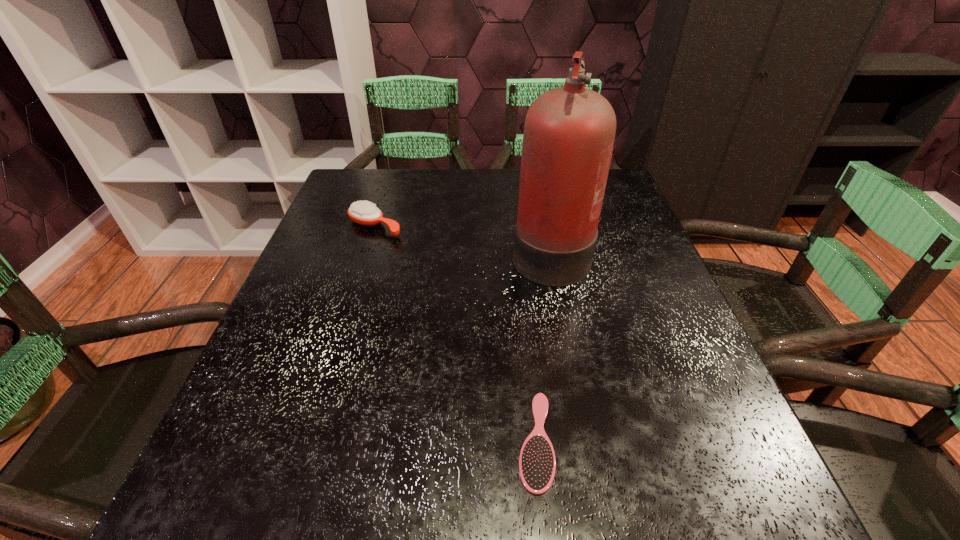
Locate which object is the closest to the nearer hairbrush. Please provide its 2D coordinates. Your answer should be formatted as a tuple, i.e. [(x, y)], where the tuple contains the x and y coordinates of a point satisfying the conditions above.

[(569, 132)]

You are a GUI agent. You are given a task and a screenshot of the screen. Output one action in this format:
    pyautogui.click(x=<x>, y=<y>)
    Task: Click on the closest object to the left hairbrush
    This screenshot has width=960, height=540.
    Given the screenshot: What is the action you would take?
    pos(569,132)

Locate an element on the screen. The width and height of the screenshot is (960, 540). free spot that satisfies the following two spatial constraints: 1. at the nozzle of the fire extinguisher; 2. on the front side of the right hairbrush is located at coordinates (587, 441).

Locate an element on the screen. Image resolution: width=960 pixels, height=540 pixels. vacant space that satisfies the following two spatial constraints: 1. on the front side of the left hairbrush; 2. on the left side of the right hairbrush is located at coordinates (308, 441).

You are a GUI agent. You are given a task and a screenshot of the screen. Output one action in this format:
    pyautogui.click(x=<x>, y=<y>)
    Task: Click on the free location that satisfies the following two spatial constraints: 1. on the front side of the second tallest object; 2. on the left side of the nearest object
    The image size is (960, 540).
    Given the screenshot: What is the action you would take?
    pyautogui.click(x=308, y=441)